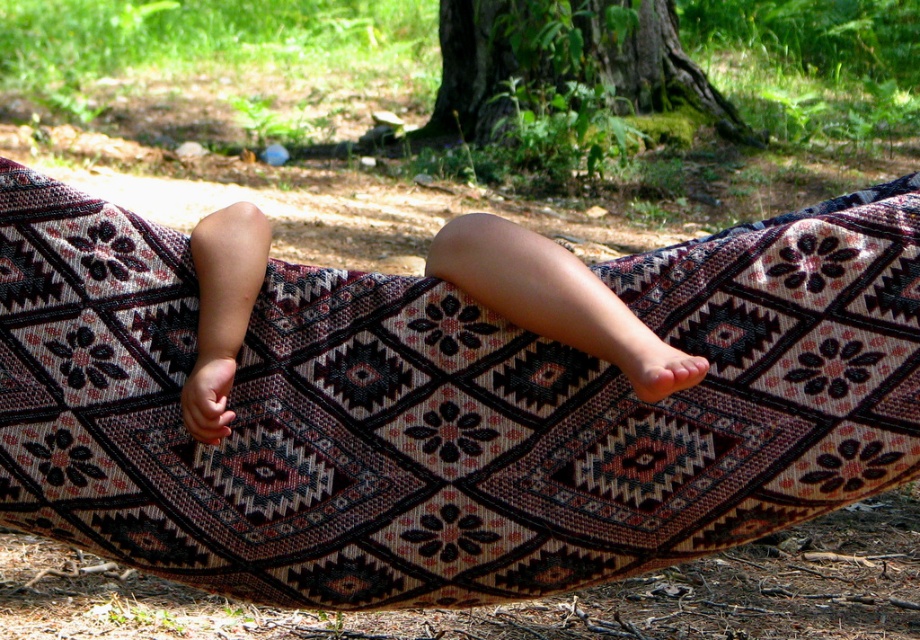
You are a photographer aiming to capture the smooth skin legs at center and the patterned fabric hammock at center in a single shot. Which object should you focus on first to ensure both are in sharp focus?

You should focus on the patterned fabric hammock at center first because it is closer to the viewer than the smooth skin legs at center, so focusing on the closer object will help ensure both are in focus.

You are a photographer trying to capture the scene. You need to decide which object to focus on first based on their widths. Which object should you focus on first, the smooth skin legs at center or the green mossy bark at center?

The green mossy bark at center has a greater width than the smooth skin legs at center, so you should focus on the green mossy bark at center first.

You are a photographer trying to capture the scene. You need to focus on the smooth skin legs at center and green mossy bark at center. Which object takes up more area in the image?

The green mossy bark at center takes up more area in the image than the smooth skin legs at center because the smooth skin legs at center occupies less space than green mossy bark at center.